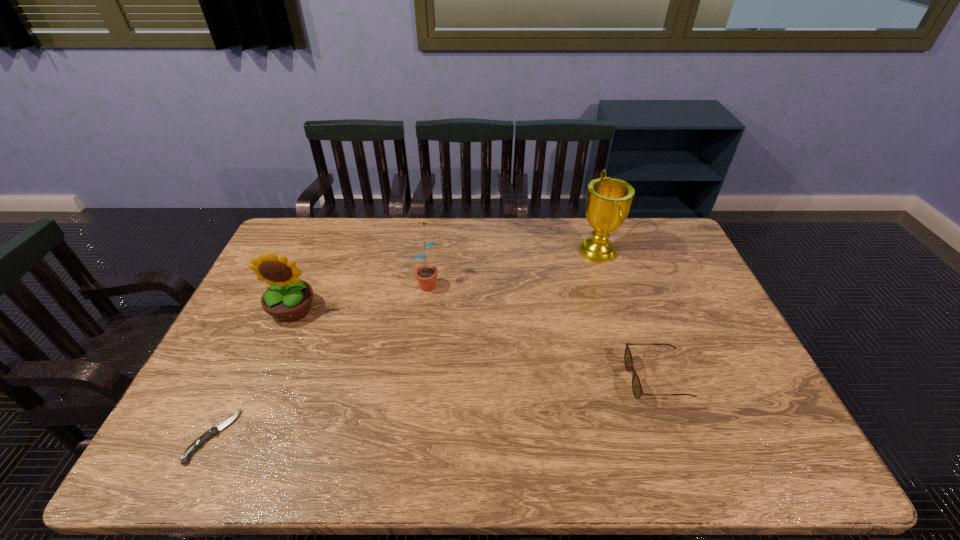
Identify the location of vacant space located on the flower of the third object from left to right. coord(424,310).

Identify the location of free space located 0.250m on the face of the left sunflower. The height and width of the screenshot is (540, 960). (252, 402).

At what (x,y) coordinates should I click in order to perform the action: click on vacant space situated 0.180m at the front view of the fourth farthest object. Please return your answer as a coordinate pair (x, y). Looking at the image, I should click on (561, 380).

Where is `vacant space located at the front view of the fourth farthest object`? The width and height of the screenshot is (960, 540). vacant space located at the front view of the fourth farthest object is located at coordinates (572, 380).

You are a GUI agent. You are given a task and a screenshot of the screen. Output one action in this format:
    pyautogui.click(x=<x>, y=<y>)
    Task: Click on the free space located at the front view of the fourth farthest object
    This screenshot has width=960, height=540.
    Given the screenshot: What is the action you would take?
    pyautogui.click(x=557, y=380)

Locate an element on the screen. free space located 0.240m on the back of the pocketknife is located at coordinates (261, 335).

Locate an element on the screen. This screenshot has height=540, width=960. object located in the far edge section of the desktop is located at coordinates (608, 201).

Where is `object at the near edge`? object at the near edge is located at coordinates (214, 431).

In order to click on sunflower present at the left edge in this screenshot , I will do `click(289, 298)`.

Find the location of `pocketknife that is at the left edge`. pocketknife that is at the left edge is located at coordinates (214, 431).